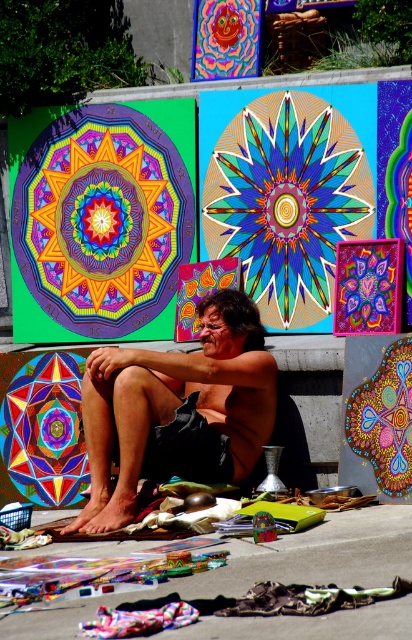
Question: Which object is positioned farthest from the vibrant glass mosaic at center?

Choices:
 (A) shiny black shorts at center
 (B) textured fabric at lower center

Answer: (B)

Question: Which object is positioned closest to the multicolored mandala at center?

Choices:
 (A) shiny black shorts at center
 (B) vibrant fabric mandala at center
 (C) vibrant glass mosaic at center
 (D) vibrant painted mandala at center

Answer: (A)

Question: Which object is closer to the camera taking this photo?

Choices:
 (A) multicolored mandala at center
 (B) vibrant glass mosaic at center
 (C) vibrant fabric mandala at center

Answer: (A)

Question: Is textured fabric at lower center above multicolored mandala at center?

Choices:
 (A) yes
 (B) no

Answer: (B)

Question: Is the position of multicolored mandala at center more distant than that of vibrant painted mandala at center?

Choices:
 (A) no
 (B) yes

Answer: (B)

Question: Is textured fabric at lower center positioned in front of vibrant painted mandala at center?

Choices:
 (A) no
 (B) yes

Answer: (B)